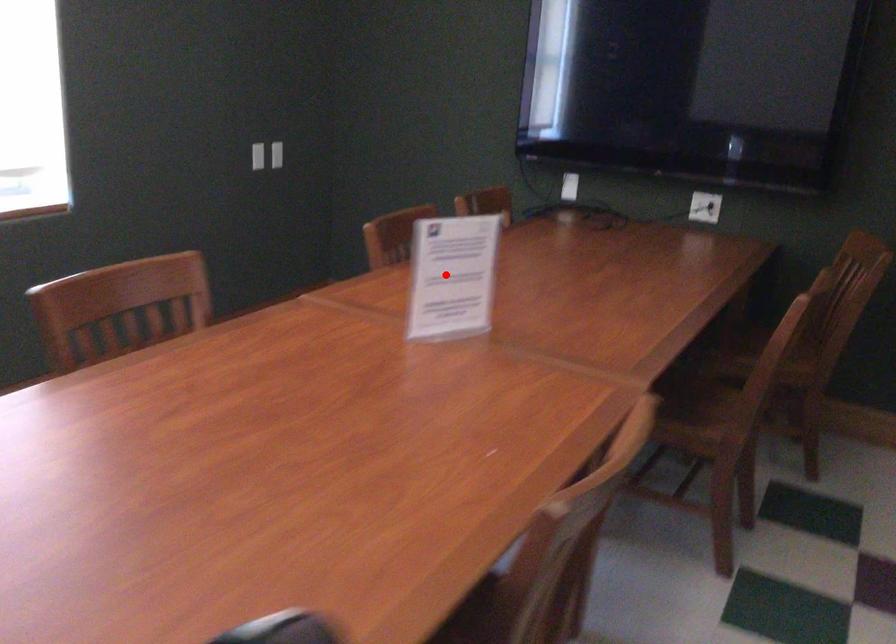
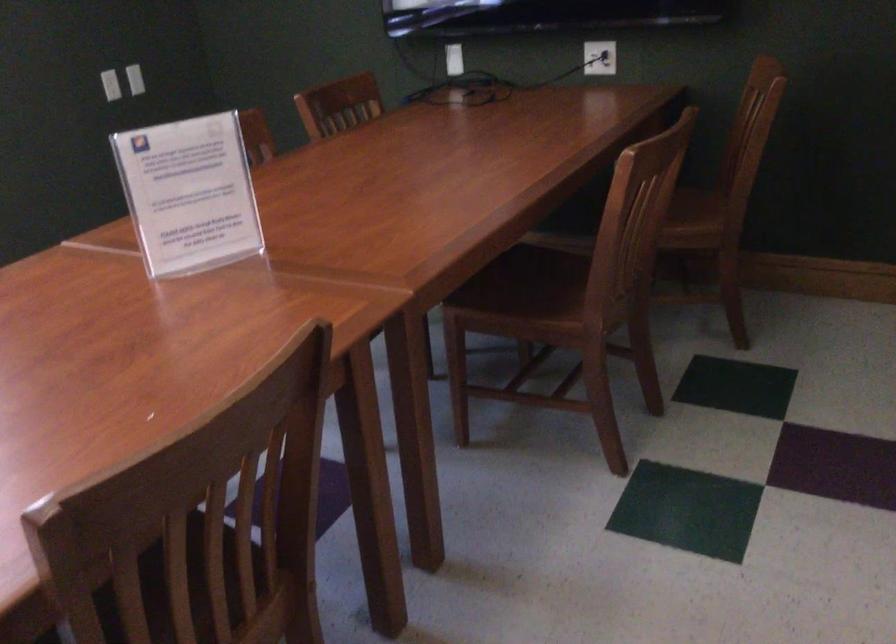
In the second image, find the point that corresponds to the highlighted location in the first image.

(188, 194)